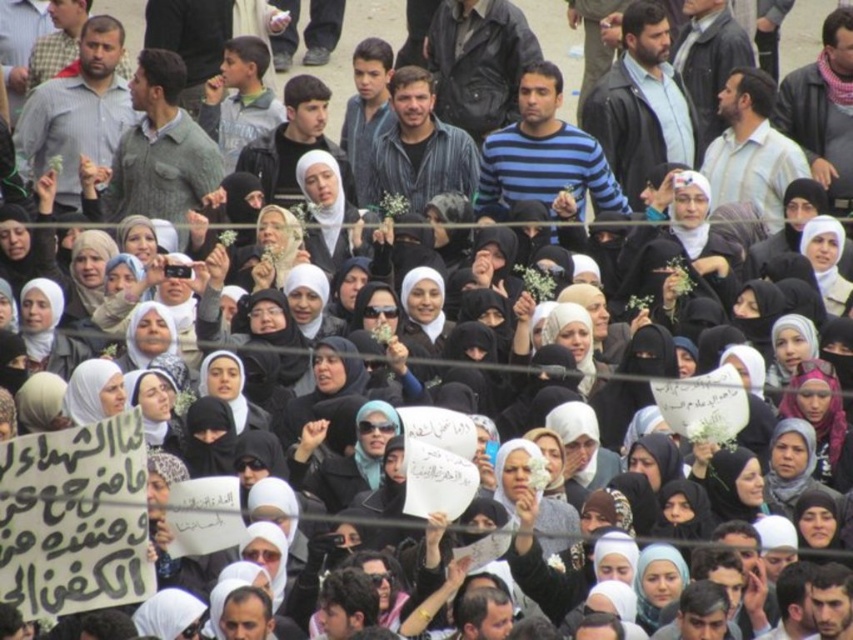
Question: Does white fabric headscarf at lower left have a smaller size compared to white fabric headscarf at center?

Choices:
 (A) no
 (B) yes

Answer: (A)

Question: Considering the relative positions of white fabric headscarf at center and matte black hijab at center in the image provided, where is white fabric headscarf at center located with respect to matte black hijab at center?

Choices:
 (A) below
 (B) above

Answer: (B)

Question: Does white fabric headscarf at lower left have a lesser width compared to matte black hijab at center?

Choices:
 (A) no
 (B) yes

Answer: (A)

Question: Which point is closer to the camera taking this photo?

Choices:
 (A) (50, 339)
 (B) (276, 243)

Answer: (A)

Question: Among these points, which one is farthest from the camera?

Choices:
 (A) (265, 288)
 (B) (241, 380)
 (C) (39, 332)

Answer: (A)

Question: Which point is farther from the camera taking this photo?

Choices:
 (A) (235, 372)
 (B) (282, 228)

Answer: (B)